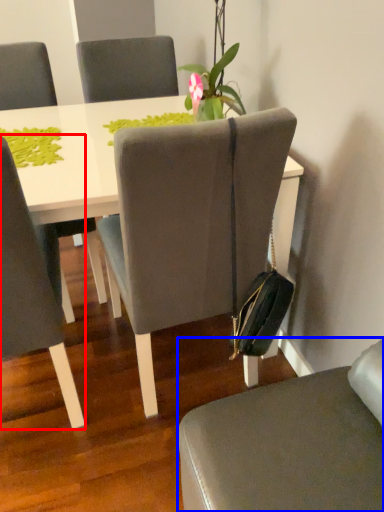
Question: Which of the following is the farthest to the observer, chair (highlighted by a red box) or chair (highlighted by a blue box)?

Choices:
 (A) chair
 (B) chair

Answer: (A)